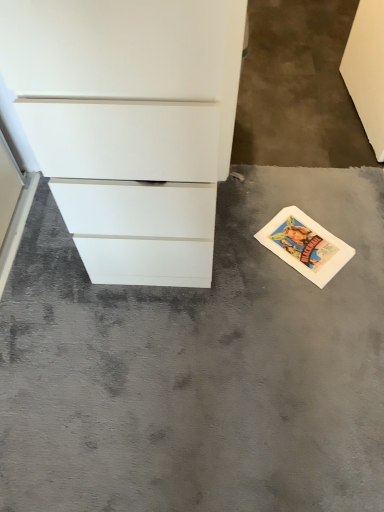
Image resolution: width=384 pixels, height=512 pixels. What are the coordinates of `vacant region to the left of white paper postcard at lower right` in the screenshot? It's located at (239, 244).